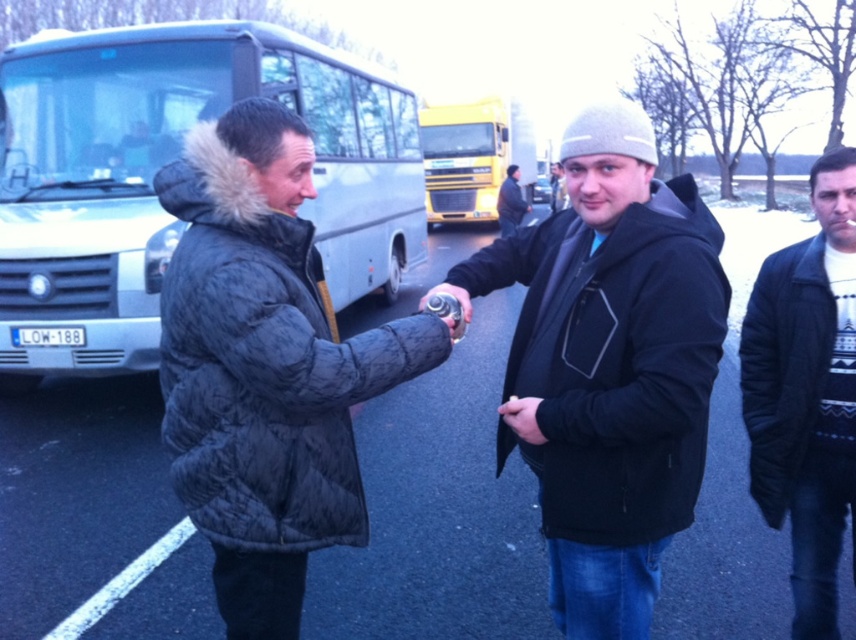
Is black quilted jacket at center positioned behind silver metallic bus at left?

That is False.

Who is more distant from viewer, (195, 541) or (123, 209)?

Positioned behind is point (123, 209).

Image resolution: width=856 pixels, height=640 pixels. Find the location of `black quilted jacket at center`. black quilted jacket at center is located at coordinates (438, 512).

Is dark blue textured coat at right taller than dark gray knit hat at center?

Yes.

Is dark blue textured coat at right above dark gray knit hat at center?

Incorrect, dark blue textured coat at right is not positioned above dark gray knit hat at center.

Is point (759, 268) in front of point (503, 221)?

Yes, it is.

You are a GUI agent. You are given a task and a screenshot of the screen. Output one action in this format:
    pyautogui.click(x=<x>, y=<y>)
    Task: Click on the dark blue textured coat at right
    The image size is (856, 640).
    Given the screenshot: What is the action you would take?
    pyautogui.click(x=806, y=394)

Locate an element on the screen. This screenshot has height=640, width=856. black quilted jacket at center is located at coordinates (438, 512).

Which is in front, point (480, 433) or point (819, 547)?

Point (819, 547) is more forward.

The image size is (856, 640). I want to click on black quilted jacket at center, so click(438, 512).